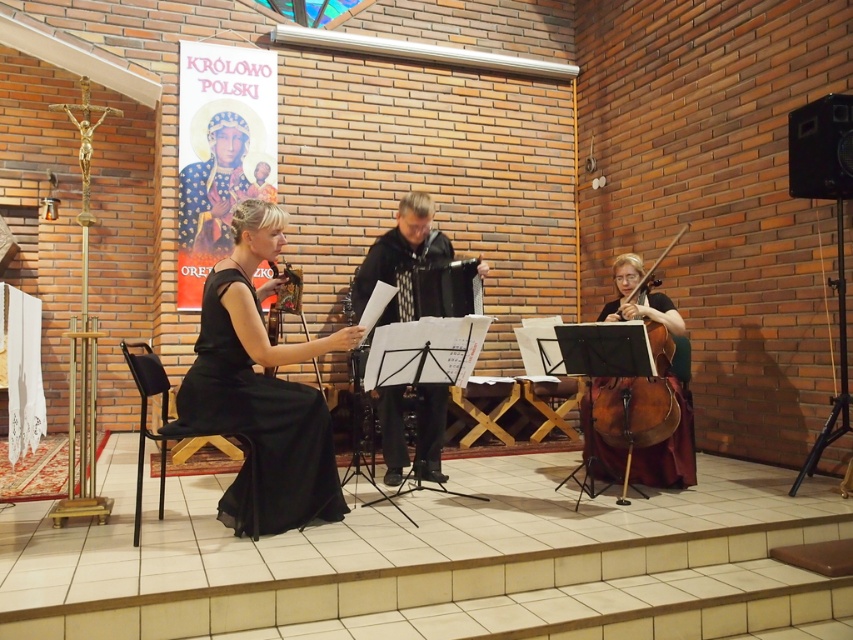
Is black satin dress at center taller than black textured accordion at center?

Yes.

Which is behind, point (219, 304) or point (399, 298)?

The point (399, 298) is more distant.

I want to click on black satin dress at center, so click(x=259, y=424).

In the scene shown: Who is higher up, black satin dress at center or brown wooden cello at right?

brown wooden cello at right

Does black satin dress at center appear on the right side of brown wooden cello at right?

Incorrect, black satin dress at center is not on the right side of brown wooden cello at right.

Which is behind, point (190, 376) or point (662, 429)?

The point (662, 429) is more distant.

Where is `black satin dress at center`? The height and width of the screenshot is (640, 853). black satin dress at center is located at coordinates (259, 424).

Can you confirm if black textured accordion at center is wider than brown wooden cello at right?

Yes, black textured accordion at center is wider than brown wooden cello at right.

Does black textured accordion at center appear over brown wooden cello at right?

Yes.

Locate an element on the screen. The height and width of the screenshot is (640, 853). black textured accordion at center is located at coordinates (401, 259).